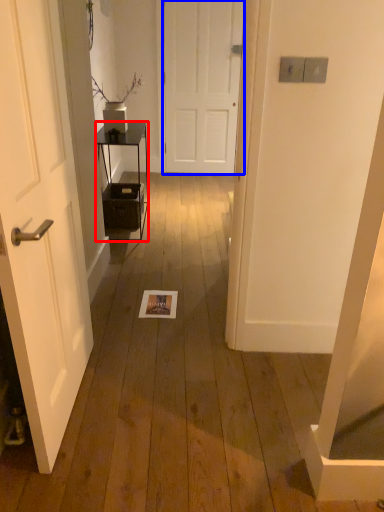
Question: Which object is closer to the camera taking this photo, furniture (highlighted by a red box) or door (highlighted by a blue box)?

Choices:
 (A) furniture
 (B) door

Answer: (A)